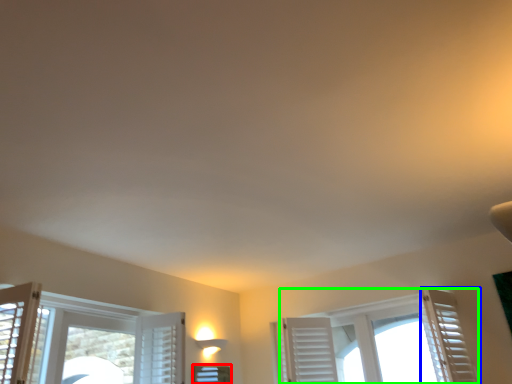
Question: Which object is positioned farthest from window (highlighted by a red box)? Select from curtain (highlighted by a blue box) and window (highlighted by a green box).

Choices:
 (A) curtain
 (B) window

Answer: (A)